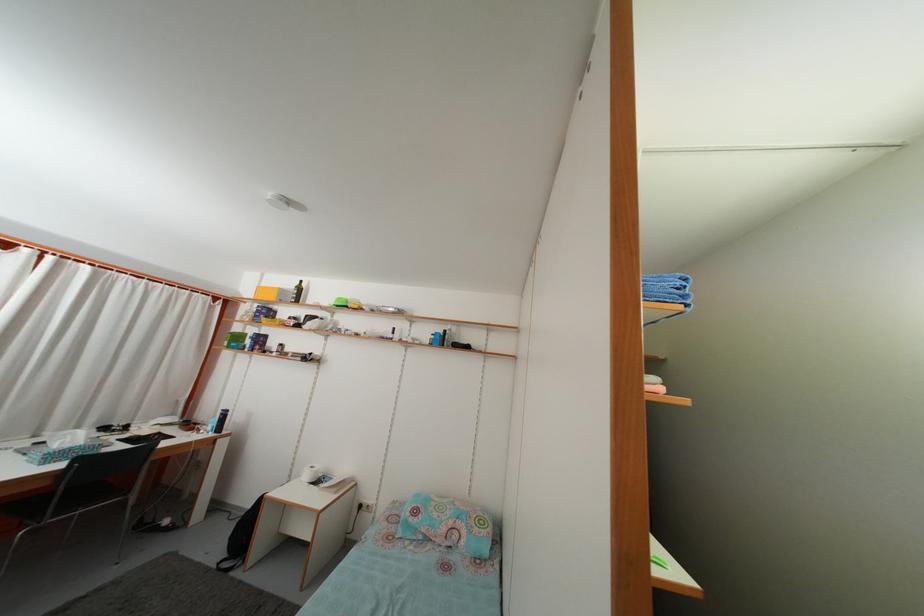
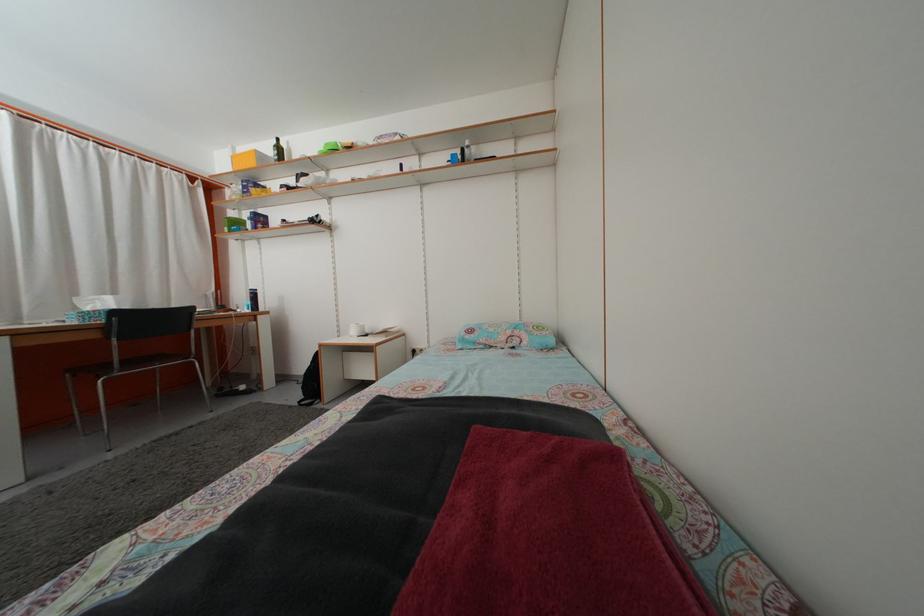
Where in the second image is the point corresponding to point 450,537 from the first image?

(508, 346)